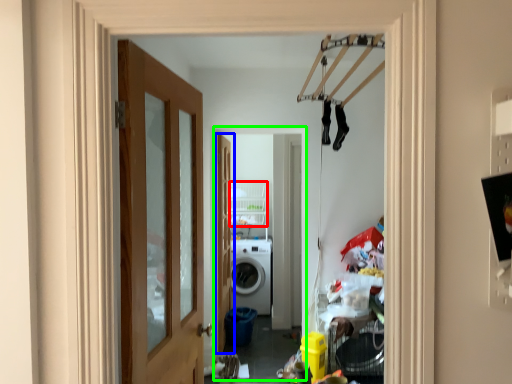
Question: Based on their relative distances, which object is farther from shelf (highlighted by a red box)? Choose from door (highlighted by a blue box) and corridor (highlighted by a green box).

Choices:
 (A) door
 (B) corridor

Answer: (A)